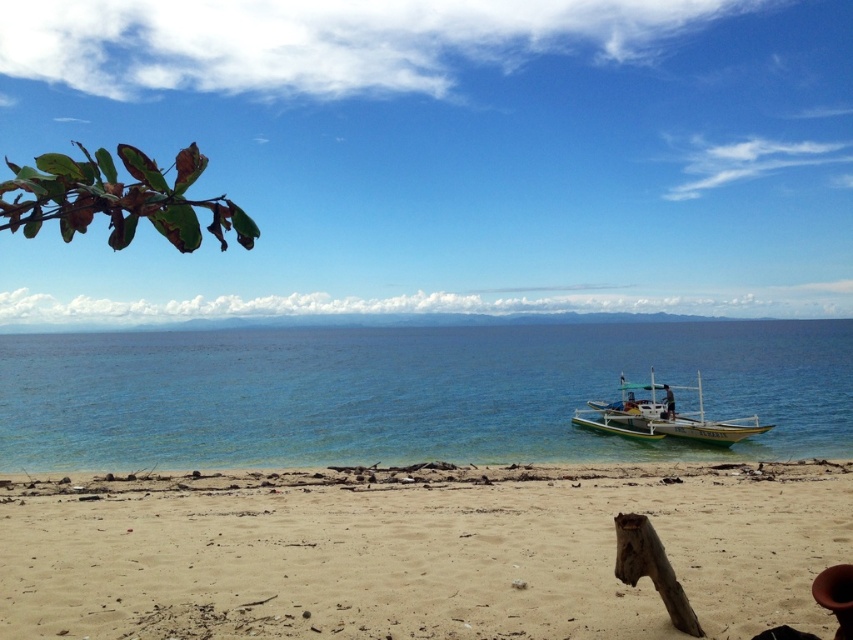
Who is more forward, (376, 488) or (700, 385)?

Point (376, 488) is in front.

Can you confirm if sandy beach at lower center is positioned below green wooden boat at lower right?

No, sandy beach at lower center is not below green wooden boat at lower right.

Is point (498, 589) more distant than point (664, 424)?

That is False.

Identify the location of sandy beach at lower center. The height and width of the screenshot is (640, 853). [416, 552].

Between blue clear water at center and green wooden boat at lower right, which one has less height?

green wooden boat at lower right

Can you confirm if blue clear water at center is positioned to the right of green wooden boat at lower right?

In fact, blue clear water at center is to the left of green wooden boat at lower right.

Is point (425, 374) positioned before point (730, 432)?

No, it is behind (730, 432).

This screenshot has height=640, width=853. I want to click on blue clear water at center, so click(x=405, y=392).

Between sandy beach at lower center and blue clear water at center, which one is positioned lower?

sandy beach at lower center

Does sandy beach at lower center have a smaller size compared to blue clear water at center?

Correct, sandy beach at lower center occupies less space than blue clear water at center.

Is point (115, 577) behind point (320, 419)?

That is False.

This screenshot has height=640, width=853. Find the location of `sandy beach at lower center`. sandy beach at lower center is located at coordinates (416, 552).